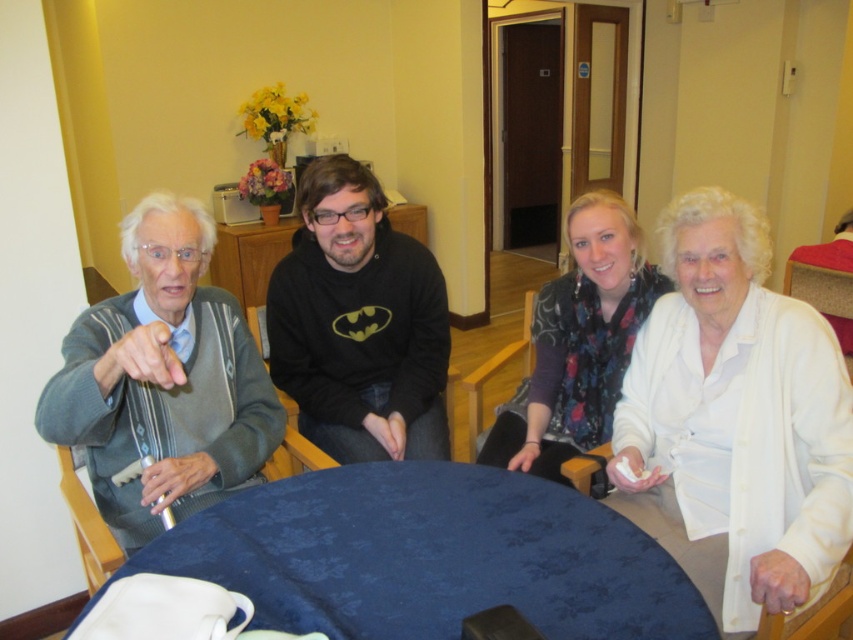
You are organizing a clothing donation drive and need to categorize items based on their size. You have a white matte cardigan at right and a floral scarf at center. Which item should you place in the large size bin?

The white matte cardigan at right has a larger size compared to the floral scarf at center, so it should be placed in the large size bin.